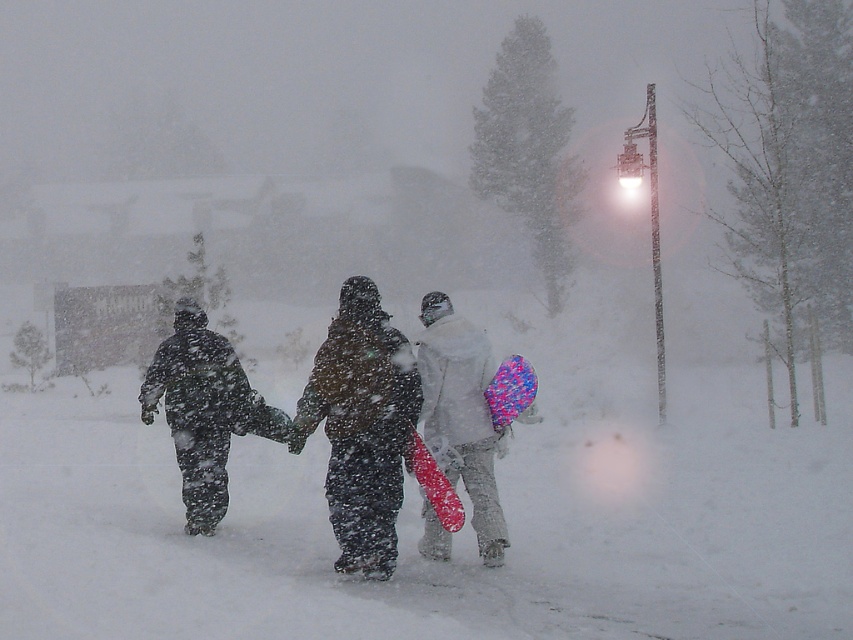
Based on the photo, you are planning to store the matte pink snowboard at center and the shiny red snowboard at center in a storage locker. The locker has limited space. Based on the scene description, which snowboard requires more storage space?

The shiny red snowboard at center requires more storage space because it occupies more space than the matte pink snowboard at center.

You are a photographer trying to capture a photo of the dark matte snowsuit at center and the matte pink snowboard at center. Based on their positions, will the snowsuit block the view of the snowboard in the photo?

The dark matte snowsuit at center is in front of the matte pink snowboard at center, so it will block the view of the snowboard in the photo.

You are a photographer trying to capture both the matte pink snowboard at center and the shiny red snowboard at center in a single shot. Since they are overlapping, which snowboard should you adjust to ensure both are fully visible?

The matte pink snowboard at center is positioned over the shiny red snowboard at center, so you should adjust the matte pink snowboard at center to move it aside to ensure both are fully visible.